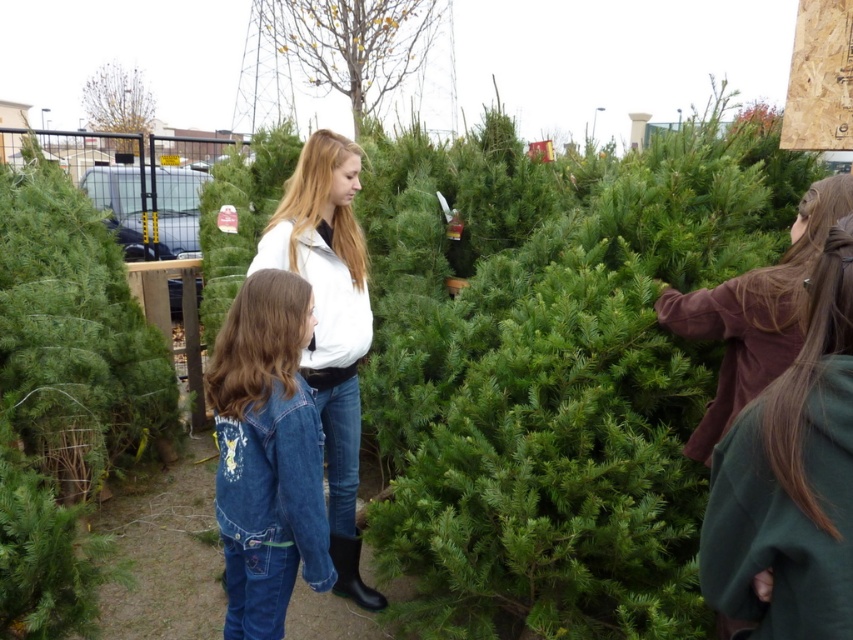
Is point (233, 396) behind point (367, 340)?

No, (233, 396) is in front of (367, 340).

Can you confirm if denim jacket at lower left is wider than white matte jacket at center?

In fact, denim jacket at lower left might be narrower than white matte jacket at center.

Is point (250, 525) more distant than point (296, 259)?

No, it is not.

Locate an element on the screen. This screenshot has width=853, height=640. denim jacket at lower left is located at coordinates [265, 454].

The image size is (853, 640). Find the location of `green textured pine tree at center`. green textured pine tree at center is located at coordinates (554, 371).

In the scene shown: Who is taller, green textured pine tree at center or brown woolen sweater at right?

Standing taller between the two is green textured pine tree at center.

Is point (602, 560) behind point (849, 301)?

Yes.

Where is `green textured pine tree at center`? The height and width of the screenshot is (640, 853). green textured pine tree at center is located at coordinates coord(554,371).

Which of these two, denim jacket at lower left or smooth bark tree at upper center, stands shorter?

Standing shorter between the two is denim jacket at lower left.

Does denim jacket at lower left appear over smooth bark tree at upper center?

Incorrect, denim jacket at lower left is not positioned above smooth bark tree at upper center.

Locate an element on the screen. denim jacket at lower left is located at coordinates (265, 454).

Where is `denim jacket at lower left`? Image resolution: width=853 pixels, height=640 pixels. denim jacket at lower left is located at coordinates (265, 454).